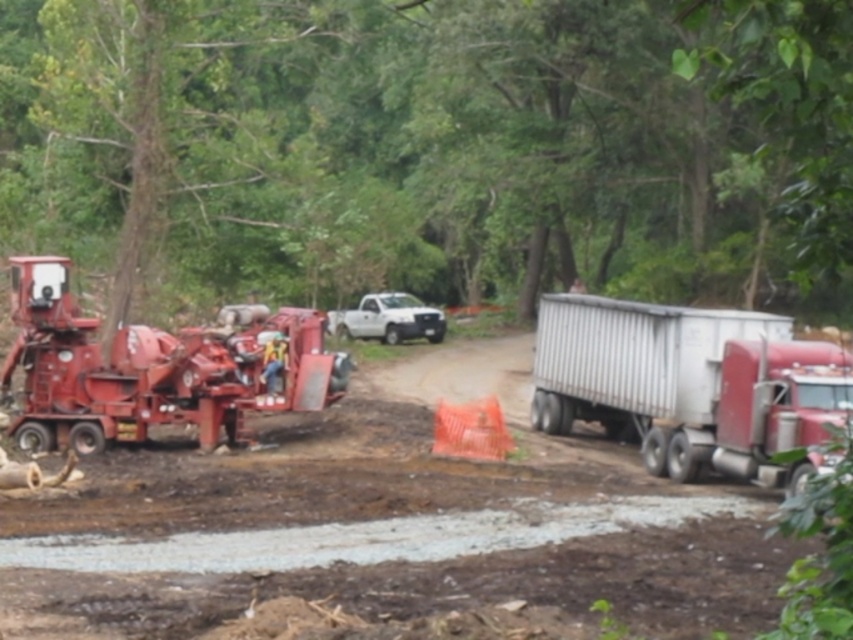
You are a safety inspector standing at the entrance of the construction site. You see the matte red construction equipment at left and the orange safety vest at center. Which object is closer to the entrance?

The orange safety vest at center is closer to the entrance because the matte red construction equipment at left is positioned over it, meaning the vest is underneath and closer to the observer.

You are standing at the construction site and want to place a new safety barrier between the two points labeled point (642, 304) and point (334, 326). Which point is closer to you where you should start placing the barrier?

Point (642, 304) is closer to the viewer than point (334, 326), so you should start placing the barrier from point (642, 304) first.